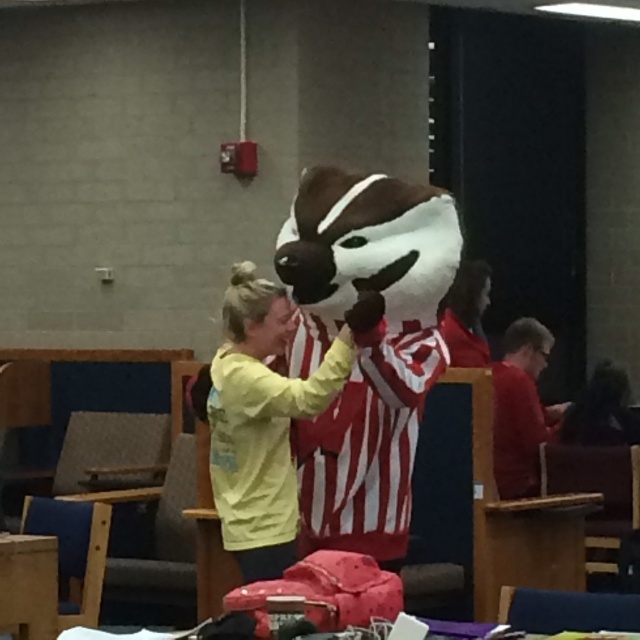
You are organizing a school event and need to arrange two volunteers wearing the yellow cotton shirt at center and the red matte shirt at right. Based on the image, which volunteer should stand to the left when facing the audience?

The volunteer wearing the yellow cotton shirt at center should stand to the left since the yellow cotton shirt at center is positioned on the left side of red matte shirt at right in the image.

Consider the image. You are standing at the origin point in the image. You want to walk to the yellow cotton shirt at center. In which direction should you move?

The yellow cotton shirt at center is located at coordinates point (262, 419). Since you are at the origin point, you should move towards the right and forward to reach it.

Please provide the 2D coordinates of the yellow cotton shirt at center in the image.

The yellow cotton shirt at center is located at the 2D coordinates of point (262,419).